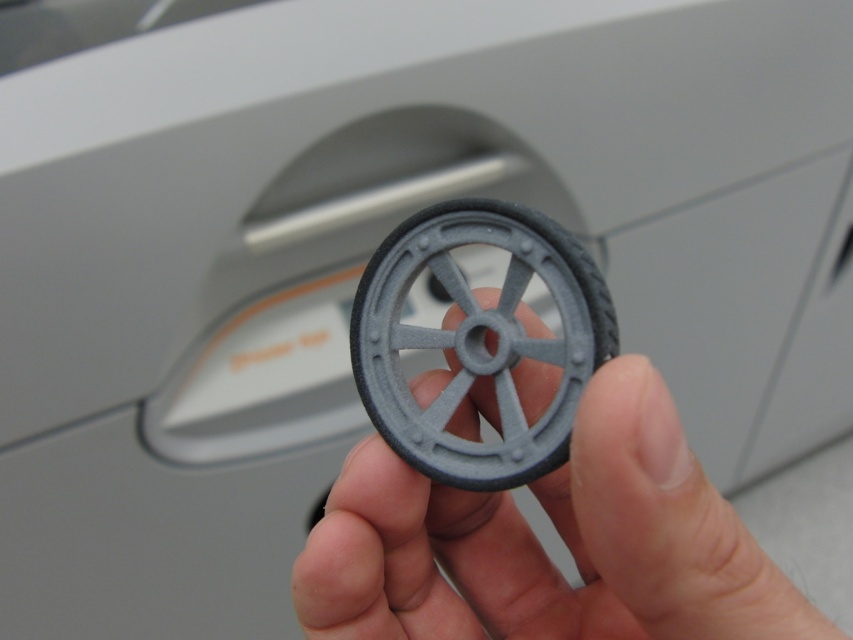
You are an engineer inspecting a 3D printed wheel. You have two options in front of you, the gray matte wheel at center and the matte gray wheel at center. Which one should you choose if you need the taller one for your project?

The gray matte wheel at center is much taller than the matte gray wheel at center, so you should choose the gray matte wheel at center for your project.